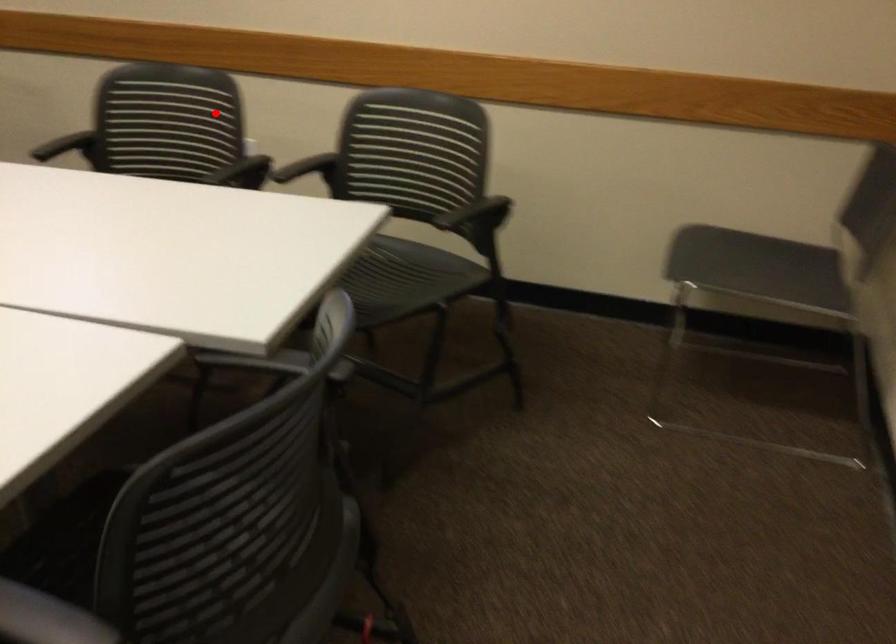
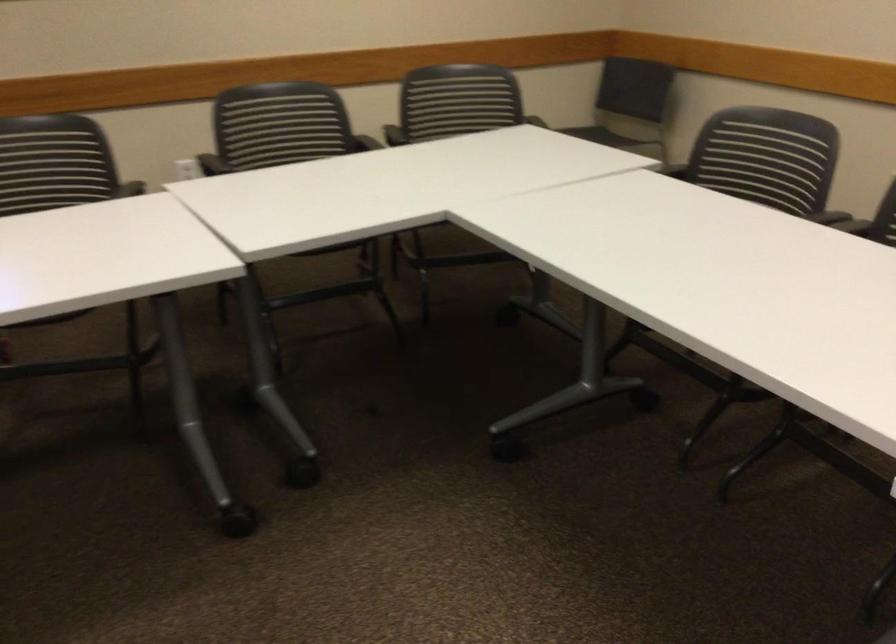
Find the pixel in the second image that matches the highlighted location in the first image.

(280, 124)